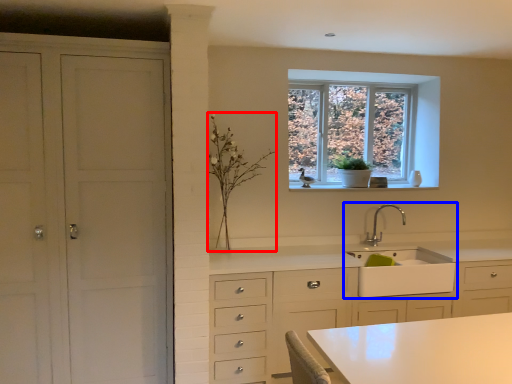
Question: Which object appears closest to the camera in this image, plant (highlighted by a red box) or sink (highlighted by a blue box)?

Choices:
 (A) plant
 (B) sink

Answer: (A)